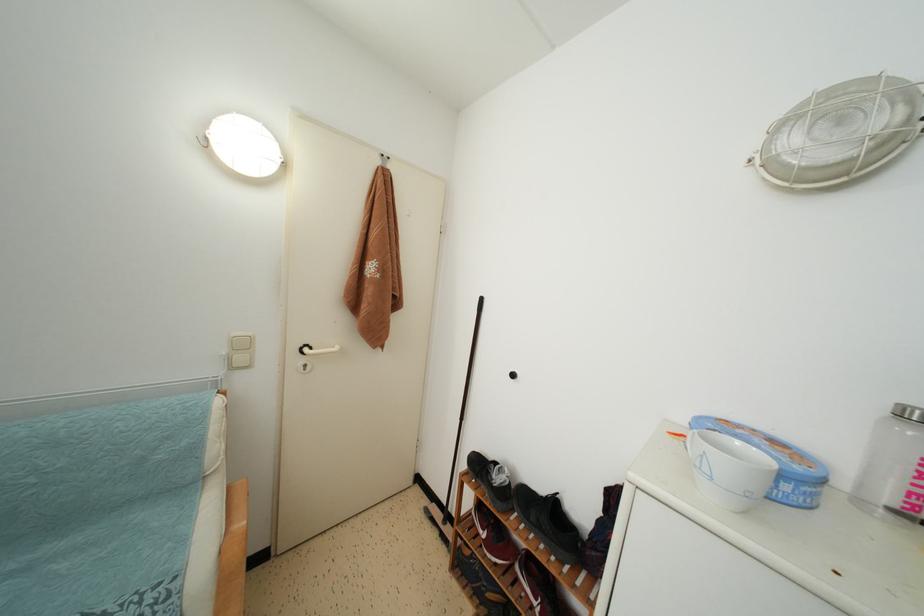
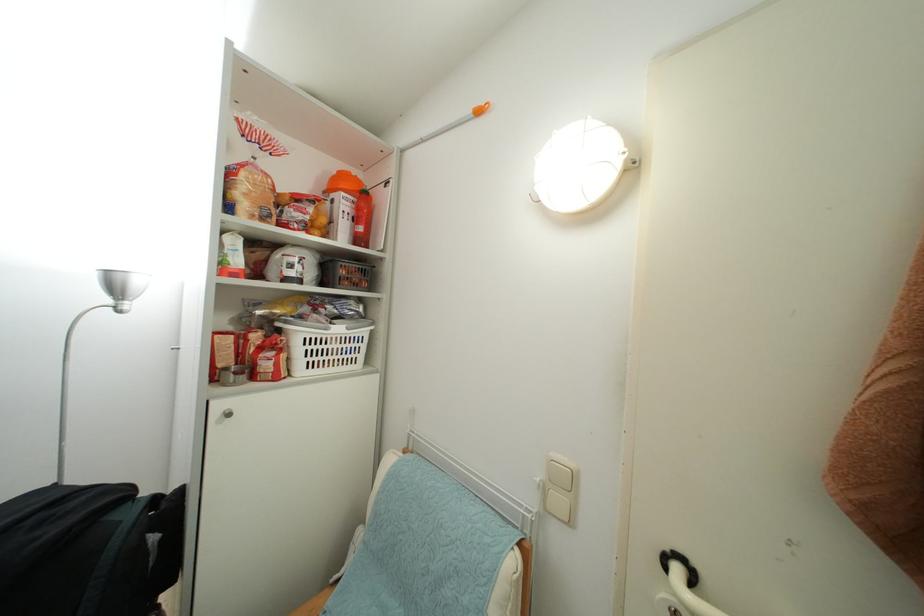
Find the pixel in the second image that matches point 245,363 in the first image.

(563, 507)